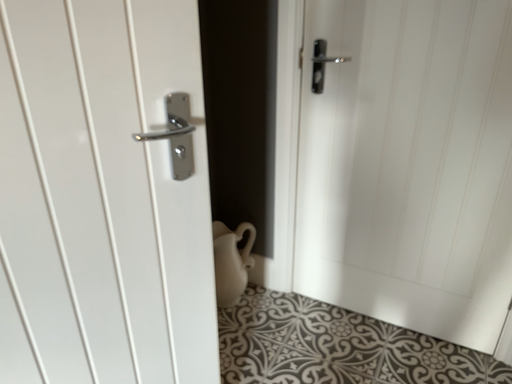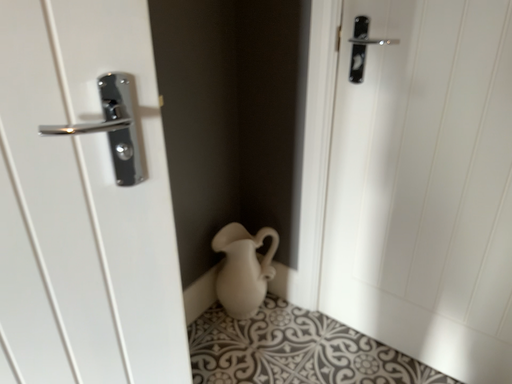
Question: How did the camera likely rotate when shooting the video?

Choices:
 (A) rotated left
 (B) rotated right

Answer: (A)